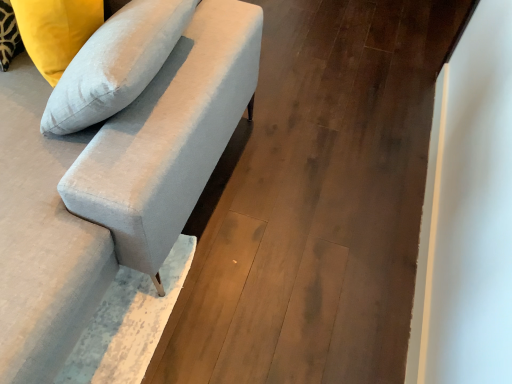
Question: Does satin white pillow at upper left have a smaller size compared to suede-like gray couch at upper left?

Choices:
 (A) no
 (B) yes

Answer: (B)

Question: Is suede-like gray couch at upper left at the back of satin white pillow at upper left?

Choices:
 (A) yes
 (B) no

Answer: (A)

Question: Could you tell me if satin white pillow at upper left is facing suede-like gray couch at upper left?

Choices:
 (A) yes
 (B) no

Answer: (A)

Question: Is satin white pillow at upper left completely or partially outside of suede-like gray couch at upper left?

Choices:
 (A) yes
 (B) no

Answer: (B)

Question: Does satin white pillow at upper left appear on the right side of suede-like gray couch at upper left?

Choices:
 (A) no
 (B) yes

Answer: (B)

Question: From a real-world perspective, is satin white pillow at upper left physically below suede-like gray couch at upper left?

Choices:
 (A) yes
 (B) no

Answer: (B)

Question: Is suede-like gray couch at upper left located within matte gray sofa at center-left?

Choices:
 (A) no
 (B) yes

Answer: (A)

Question: From a real-world perspective, is matte gray sofa at center-left below suede-like gray couch at upper left?

Choices:
 (A) no
 (B) yes

Answer: (B)

Question: From a real-world perspective, is matte gray sofa at center-left physically above suede-like gray couch at upper left?

Choices:
 (A) yes
 (B) no

Answer: (B)

Question: Is matte gray sofa at center-left bigger than suede-like gray couch at upper left?

Choices:
 (A) no
 (B) yes

Answer: (A)

Question: Is matte gray sofa at center-left turned away from suede-like gray couch at upper left?

Choices:
 (A) yes
 (B) no

Answer: (B)

Question: Does matte gray sofa at center-left come behind suede-like gray couch at upper left?

Choices:
 (A) yes
 (B) no

Answer: (A)

Question: Is satin white pillow at upper left positioned with its back to matte gray sofa at center-left?

Choices:
 (A) no
 (B) yes

Answer: (A)